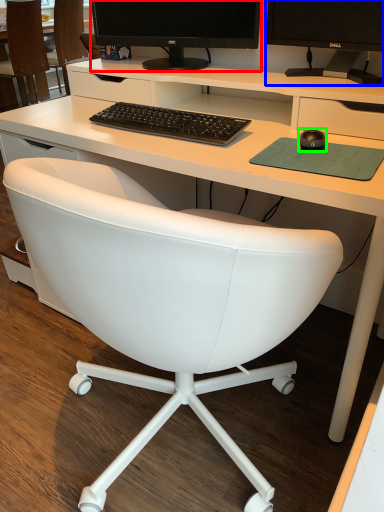
Question: Which object is positioned closest to computer monitor (highlighted by a red box)? Select from television (highlighted by a blue box) and mouse (highlighted by a green box).

Choices:
 (A) television
 (B) mouse

Answer: (A)